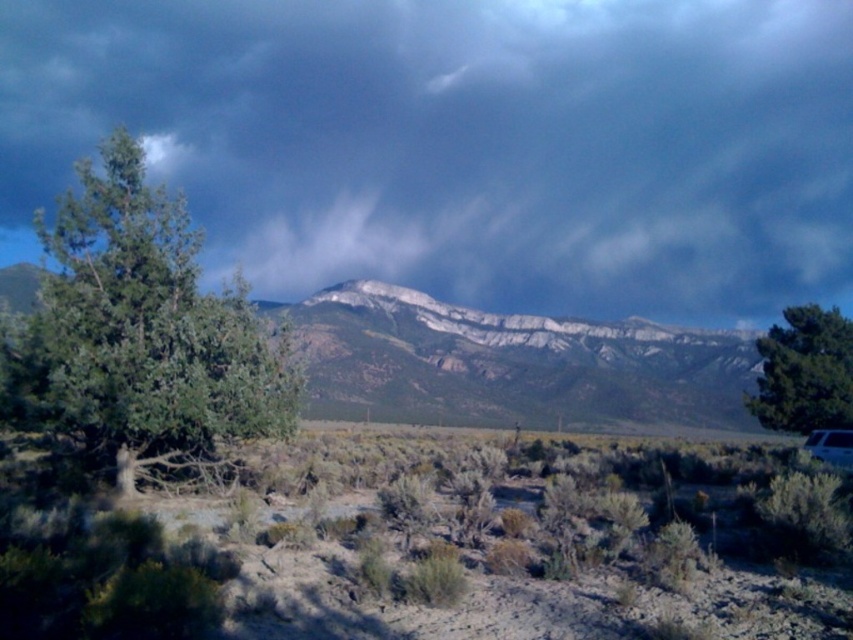
You are standing at the base of the mountain in the image and want to reach the point marked at coordinates point (x=683, y=292). If you can walk 100 meters per hour, how many hours will it take you to reach that point?

The distance between you and point (x=683, y=292) is 161.92 meters. At a walking speed of 100 meters per hour, it would take approximately 1.62 hours to reach the point.

You are a hiker planning to take shelter under the green leafy tree at right. Will the dark gray cloud at upper center currently be blocking the view of the tree?

The dark gray cloud at upper center is positioned over the green leafy tree at right, so it may block part of the tree from view depending on the cloud density and observer angle.

You are standing at the center of the image and want to locate the green matte tree at left. According to the coordinates, in which direction should you look to find it?

The green matte tree at left is located at coordinates point (142, 333). Since you are at the center, you should look to the left to find it.